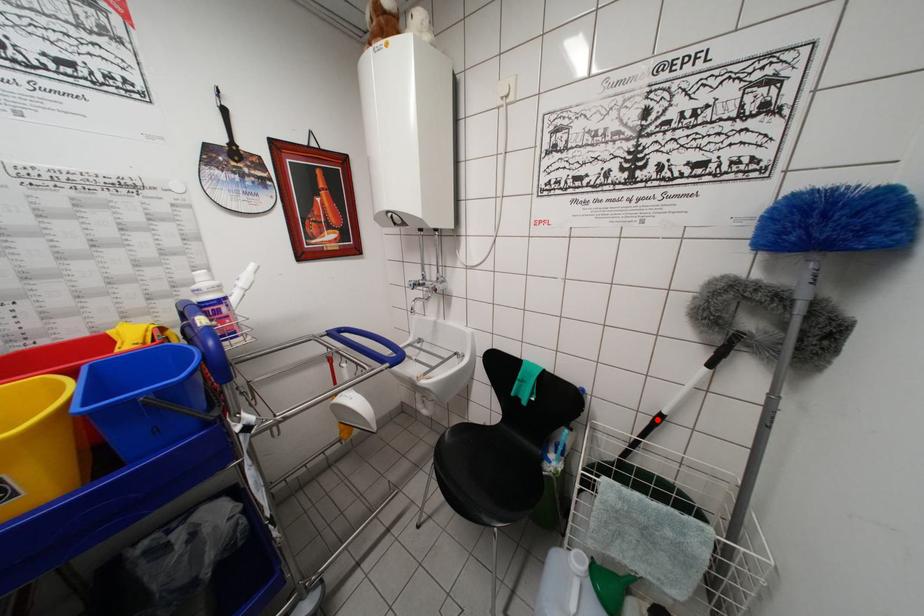
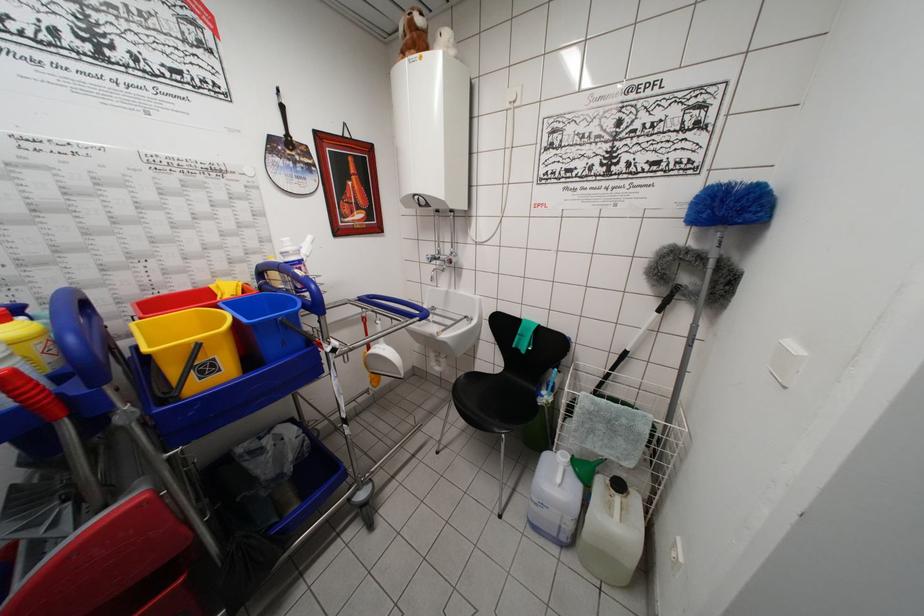
Find the pixel in the second image that matches the highlighted location in the first image.

(624, 358)